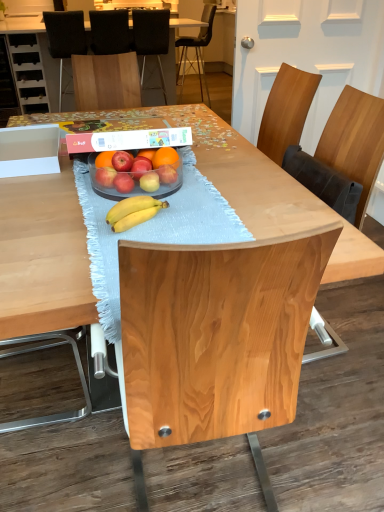
Where is `vacant space in front of matte red apple at center, the 6th apple when ordered from right to left`? vacant space in front of matte red apple at center, the 6th apple when ordered from right to left is located at coordinates (117, 202).